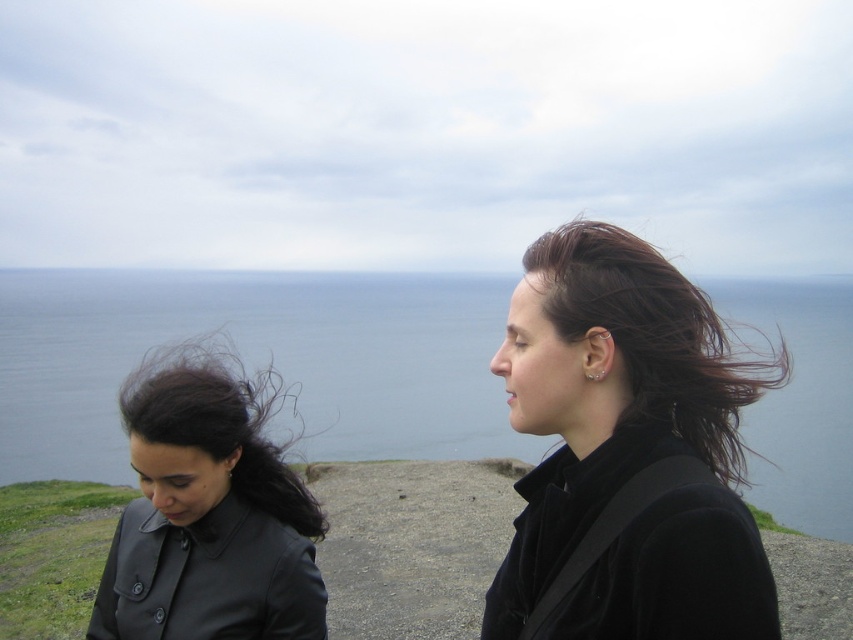
You are a photographer trying to capture a landscape shot of the blue water at center and the matte black jacket at left. Based on their positions, which object appears closer to the camera?

The blue water at center appears closer to the camera because it is much taller than the matte black jacket at left, indicating it occupies a larger portion of the frame.

You are a photographer trying to capture the scene with the two jackets. Which jacket, the black velvet jacket at upper right or the matte black jacket at left, is located more to the right side of the image?

The black velvet jacket at upper right is more to the right side of the image because it is positioned on the right side of the matte black jacket at left.